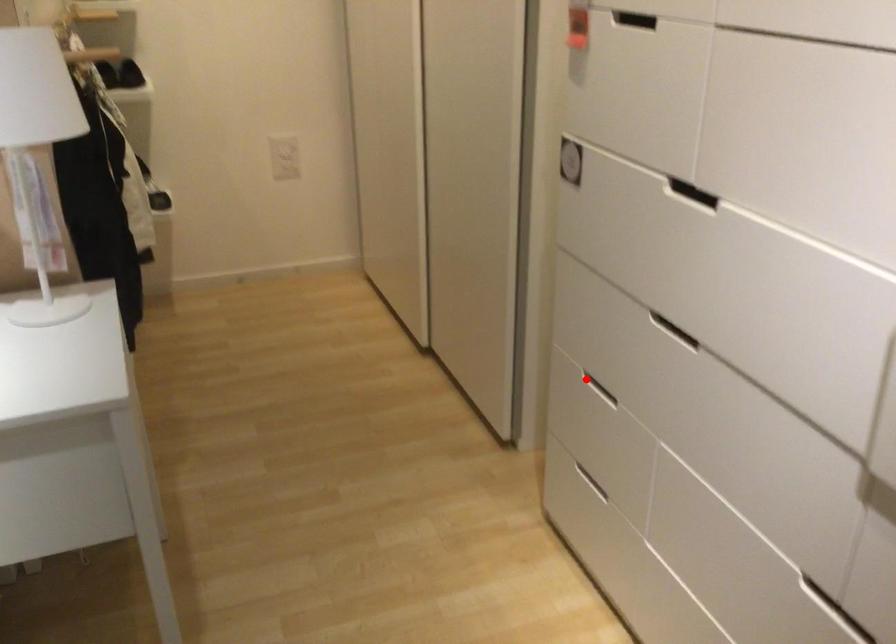
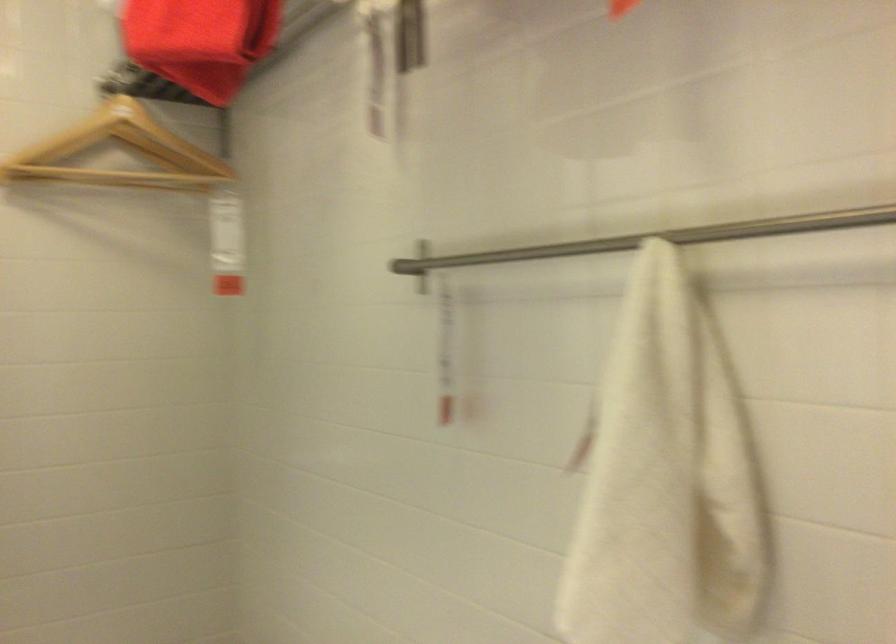
Question: I am providing you with two images of the same scene from different viewpoints. A red point is marked on the first image. Is the red point's position out of view in image 2?

Choices:
 (A) Yes
 (B) No

Answer: (A)